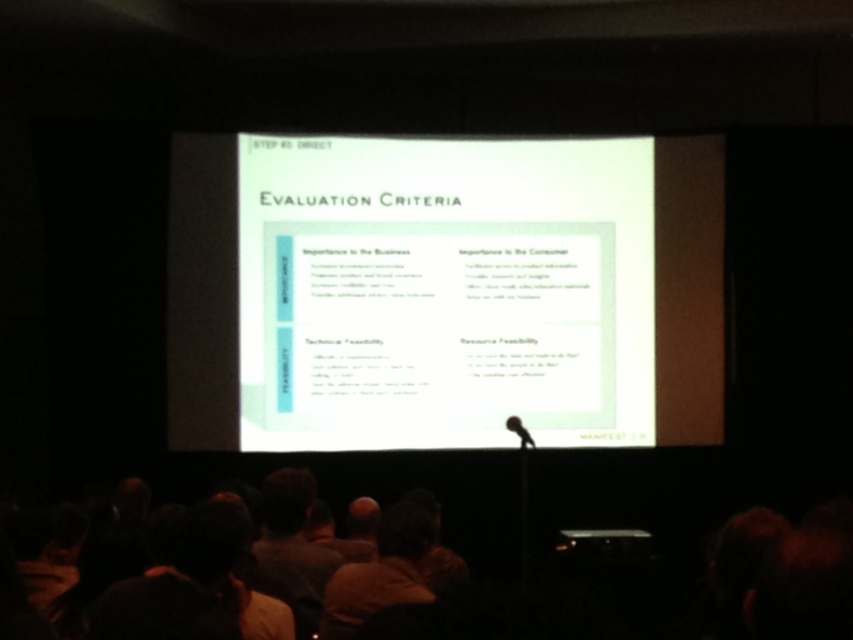
Based on the photo, is white paper at center smaller than black matte microphone at center?

Incorrect, white paper at center is not smaller in size than black matte microphone at center.

Does white paper at center have a greater height compared to black matte microphone at center?

Indeed, white paper at center has a greater height compared to black matte microphone at center.

Who is more distant from viewer, [329,378] or [525,440]?

The point [329,378] is more distant.

Where is `white paper at center`? The image size is (853, 640). white paper at center is located at coordinates (444, 292).

Between brown hair at lower center and black matte microphone at center, which one is positioned lower?

brown hair at lower center

Find the location of a particular element. brown hair at lower center is located at coordinates (380, 572).

Which is in front, point (339, 632) or point (509, 417)?

Point (339, 632) is more forward.

At what (x,y) coordinates should I click in order to perform the action: click on brown hair at lower center. Please return your answer as a coordinate pair (x, y). This screenshot has width=853, height=640. Looking at the image, I should click on pos(380,572).

Describe the element at coordinates (444, 292) in the screenshot. This screenshot has height=640, width=853. I see `white paper at center` at that location.

Between white paper at center and brown hair at lower center, which one appears on the left side from the viewer's perspective?

From the viewer's perspective, brown hair at lower center appears more on the left side.

The height and width of the screenshot is (640, 853). What do you see at coordinates (444, 292) in the screenshot? I see `white paper at center` at bounding box center [444, 292].

This screenshot has height=640, width=853. Identify the location of white paper at center. (444, 292).